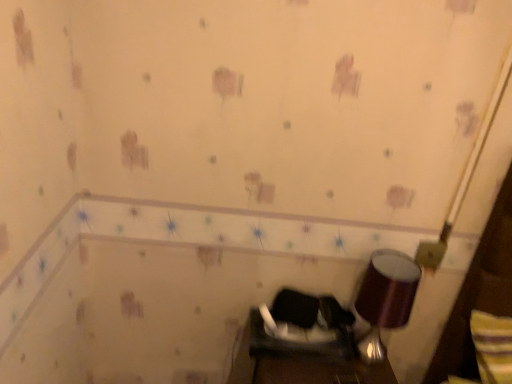
This screenshot has width=512, height=384. In order to click on black fabric swivel chair at center in this screenshot , I will do `click(302, 327)`.

The width and height of the screenshot is (512, 384). Describe the element at coordinates (302, 327) in the screenshot. I see `black fabric swivel chair at center` at that location.

Measure the distance between point [393,316] and camera.

3.95 feet.

Locate an element on the screen. This screenshot has width=512, height=384. shiny metallic lampshade at lower right is located at coordinates (385, 299).

The image size is (512, 384). Describe the element at coordinates (385, 299) in the screenshot. I see `shiny metallic lampshade at lower right` at that location.

Where is `black fabric swivel chair at center`? The height and width of the screenshot is (384, 512). black fabric swivel chair at center is located at coordinates (302, 327).

Considering the positions of objects shiny metallic lampshade at lower right and black fabric swivel chair at center in the image provided, who is more to the right, shiny metallic lampshade at lower right or black fabric swivel chair at center?

Positioned to the right is shiny metallic lampshade at lower right.

Is shiny metallic lampshade at lower right positioned in front of black fabric swivel chair at center?

Yes.

Which is farther, (403, 274) or (289, 335)?

The point (289, 335) is behind.

From the image's perspective, between shiny metallic lampshade at lower right and black fabric swivel chair at center, who is located below?

black fabric swivel chair at center appears lower in the image.

From a real-world perspective, between shiny metallic lampshade at lower right and black fabric swivel chair at center, who is vertically higher?

From a 3D spatial view, shiny metallic lampshade at lower right is above.

Is shiny metallic lampshade at lower right thinner than black fabric swivel chair at center?

No.

Does shiny metallic lampshade at lower right have a lesser height compared to black fabric swivel chair at center?

No, shiny metallic lampshade at lower right is not shorter than black fabric swivel chair at center.

Which of these two, shiny metallic lampshade at lower right or black fabric swivel chair at center, is bigger?

shiny metallic lampshade at lower right is bigger.

Is black fabric swivel chair at center a part of shiny metallic lampshade at lower right?

No, shiny metallic lampshade at lower right does not contain black fabric swivel chair at center.

Are shiny metallic lampshade at lower right and black fabric swivel chair at center located far from each other?

Actually, shiny metallic lampshade at lower right and black fabric swivel chair at center are a little close together.

Is shiny metallic lampshade at lower right oriented towards black fabric swivel chair at center?

No, shiny metallic lampshade at lower right is not turned towards black fabric swivel chair at center.

How many degrees apart are the facing directions of shiny metallic lampshade at lower right and black fabric swivel chair at center?

0.374 degrees separate the facing orientations of shiny metallic lampshade at lower right and black fabric swivel chair at center.

This screenshot has width=512, height=384. Identify the location of swivel chair that is below the shiny metallic lampshade at lower right (from the image's perspective). (302, 327).

Does black fabric swivel chair at center appear on the left side of shiny metallic lampshade at lower right?

Correct, you'll find black fabric swivel chair at center to the left of shiny metallic lampshade at lower right.

Between black fabric swivel chair at center and shiny metallic lampshade at lower right, which one is positioned in front?

shiny metallic lampshade at lower right is closer to the camera.

Is point (252, 331) farther from camera compared to point (361, 341)?

No, it is in front of (361, 341).

From the image's perspective, is black fabric swivel chair at center beneath shiny metallic lampshade at lower right?

Correct, black fabric swivel chair at center appears lower than shiny metallic lampshade at lower right in the image.

Looking at this image, from a real-world perspective, does black fabric swivel chair at center stand above shiny metallic lampshade at lower right?

Actually, black fabric swivel chair at center is physically below shiny metallic lampshade at lower right in the real world.

Based on the photo, between black fabric swivel chair at center and shiny metallic lampshade at lower right, which one has smaller width?

With smaller width is black fabric swivel chair at center.

Can you confirm if black fabric swivel chair at center is taller than shiny metallic lampshade at lower right?

No.

In the scene shown: Between black fabric swivel chair at center and shiny metallic lampshade at lower right, which one has smaller size?

With smaller size is black fabric swivel chair at center.

Is black fabric swivel chair at center positioned beyond the bounds of shiny metallic lampshade at lower right?

That's correct, black fabric swivel chair at center is outside of shiny metallic lampshade at lower right.

Are black fabric swivel chair at center and shiny metallic lampshade at lower right located far from each other?

That's not correct — black fabric swivel chair at center is a little close to shiny metallic lampshade at lower right.

Is black fabric swivel chair at center turned away from shiny metallic lampshade at lower right?

No, black fabric swivel chair at center is not facing the opposite direction of shiny metallic lampshade at lower right.

Consider the image. How many degrees apart are the facing directions of black fabric swivel chair at center and shiny metallic lampshade at lower right?

The facing directions of black fabric swivel chair at center and shiny metallic lampshade at lower right are 0.374 degrees apart.

Locate an element on the screen. This screenshot has height=384, width=512. swivel chair below the shiny metallic lampshade at lower right (from a real-world perspective) is located at coordinates (302, 327).

At what (x,y) coordinates should I click in order to perform the action: click on lamp on the right of the black fabric swivel chair at center. Please return your answer as a coordinate pair (x, y). Looking at the image, I should click on (385, 299).

Find the location of a particular element. The width and height of the screenshot is (512, 384). swivel chair directly beneath the shiny metallic lampshade at lower right (from a real-world perspective) is located at coordinates (302, 327).